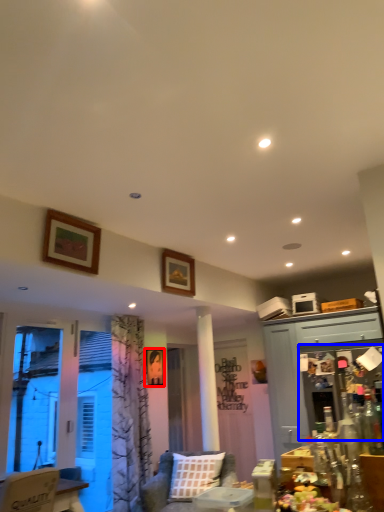
Question: Which of the following is the farthest to the observer, picture frame (highlighted by a red box) or screen door (highlighted by a blue box)?

Choices:
 (A) picture frame
 (B) screen door

Answer: (A)